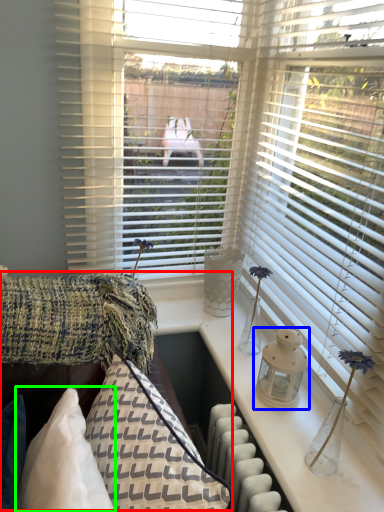
Question: Based on their relative distances, which object is nearer to couch (highlighted by a red box)? Choose from candle holder (highlighted by a blue box) and pillow (highlighted by a green box).

Choices:
 (A) candle holder
 (B) pillow

Answer: (B)